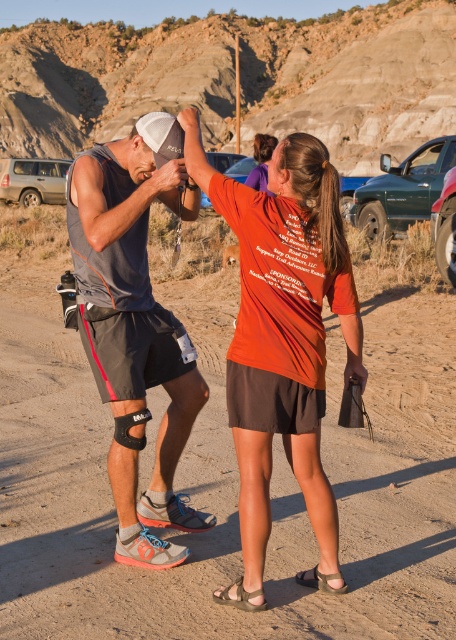
Who is positioned more to the left, matte gray tank top at center or silver metallic suv at upper left?

From the viewer's perspective, silver metallic suv at upper left appears more on the left side.

Between matte gray tank top at center and silver metallic suv at upper left, which one has more height?

silver metallic suv at upper left is taller.

Image resolution: width=456 pixels, height=640 pixels. Find the location of `matte gray tank top at center`. matte gray tank top at center is located at coordinates (135, 324).

Does point (267, 195) lie in front of point (5, 179)?

Yes, point (267, 195) is in front of point (5, 179).

Who is positioned more to the right, orange cotton shirt at center or silver metallic suv at upper left?

orange cotton shirt at center is more to the right.

The image size is (456, 640). Identify the location of orange cotton shirt at center. (285, 260).

Does matte gray tank top at center have a lesser height compared to orange cotton shirt at center?

Correct, matte gray tank top at center is not as tall as orange cotton shirt at center.

Can you confirm if matte gray tank top at center is taller than orange cotton shirt at center?

No.

Is point (124, 470) positioned before point (231, 218)?

No, (124, 470) is behind (231, 218).

At what (x,y) coordinates should I click in order to perform the action: click on matte gray tank top at center. Please return your answer as a coordinate pair (x, y). This screenshot has width=456, height=640. Looking at the image, I should click on (135, 324).